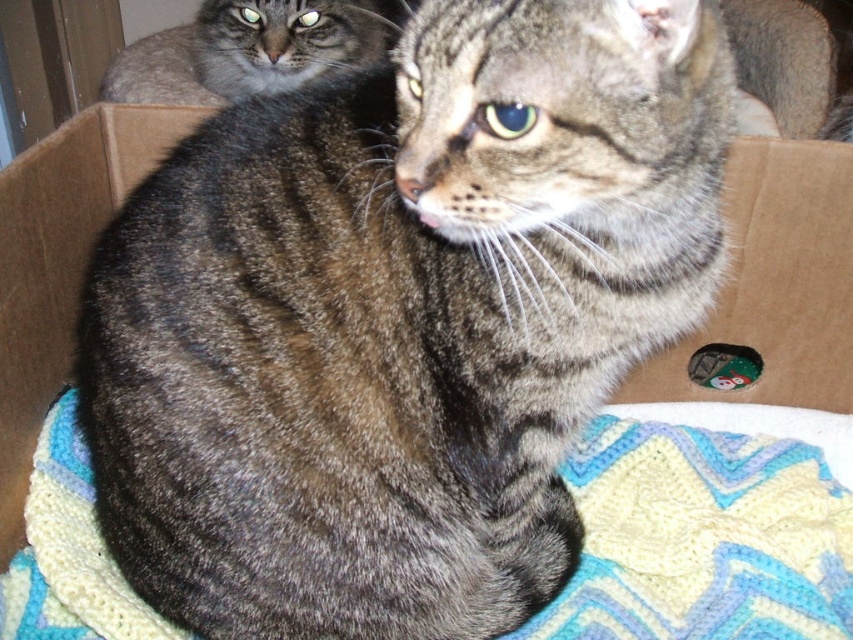
You are trying to decide whether to place a new toy inside the brown cardboard box at upper left. The toy requires a space larger than the tabby fur cat at upper left to fit comfortably. Based on the scene, will the toy fit inside the box?

The brown cardboard box at upper left has a smaller size compared to the tabby fur cat at upper left, so the toy will not fit inside the box since the box is smaller than the cat and the toy requires a space larger than the cat.

You are a cat owner trying to place two identical cat beds in the living room. You have a brown cardboard box at center and a brown cardboard box at upper left. According to the image, where should you place each cat bed so they are positioned correctly relative to each other?

Place the first cat bed to the right of the brown cardboard box at upper left so it aligns with the brown cardboard box at center, since the brown cardboard box at center is to the right of the brown cardboard box at upper left as shown in the image.

You are a photographer trying to capture both cats in a cardboard box. You notice two specific points in the image labeled as point (844, 365) and point (22, 241). Which point is closer to your camera lens?

Point (844, 365) is further to the viewer than point (22, 241), so the point closer to the camera lens is point (22, 241).